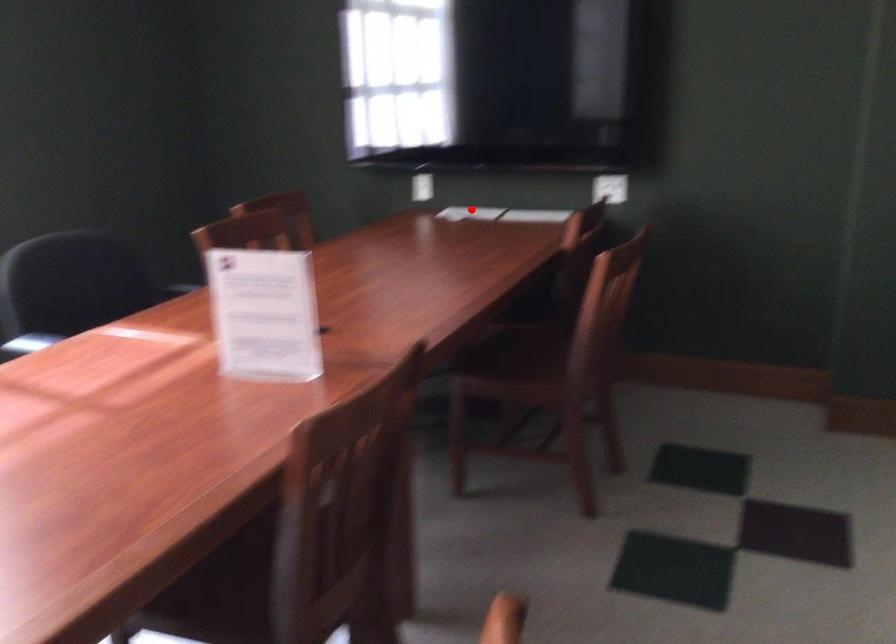
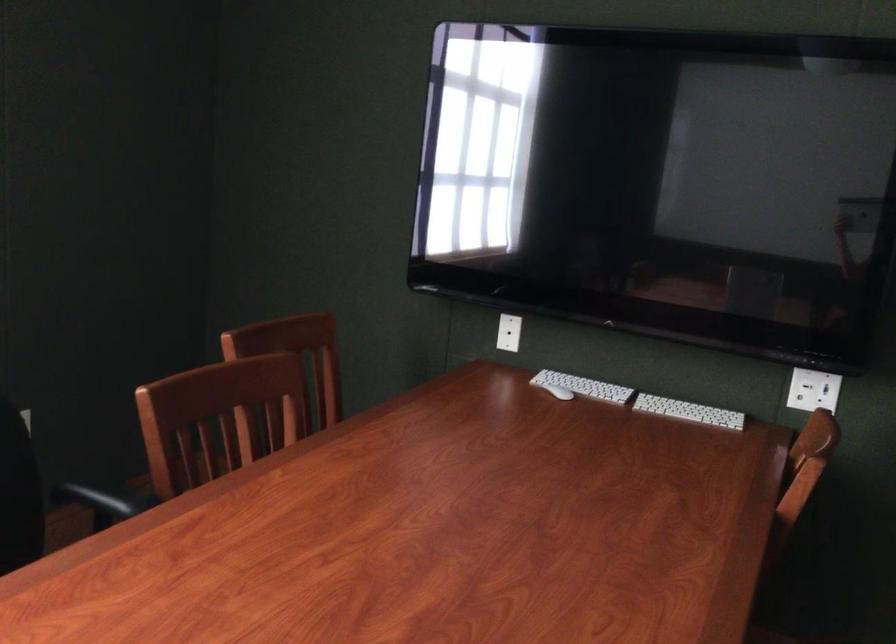
Find the pixel in the second image that matches the highlighted location in the first image.

(583, 386)